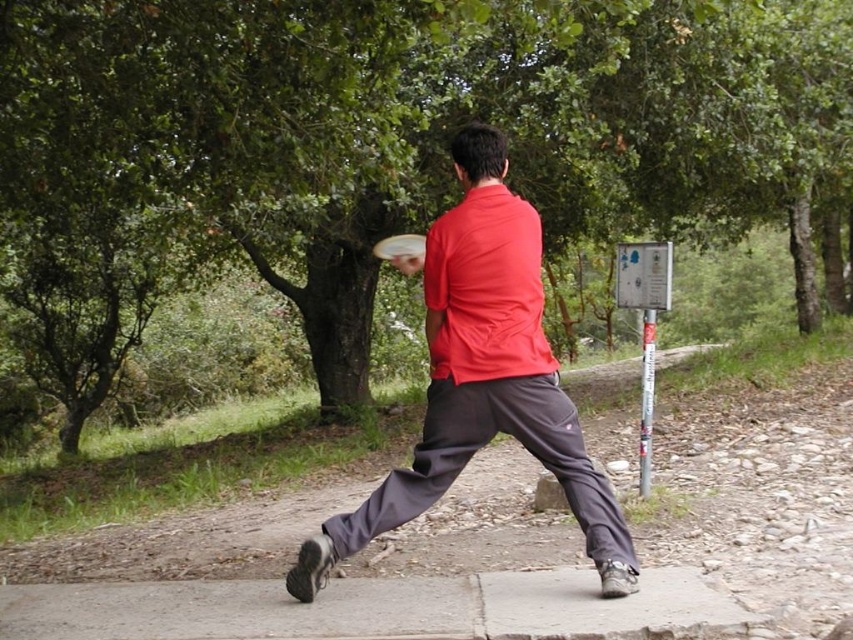
Can you confirm if green leafy tree at center is smaller than white plastic frisbee at center?

No.

The image size is (853, 640). I want to click on green leafy tree at center, so click(376, 145).

The width and height of the screenshot is (853, 640). I want to click on green leafy tree at center, so click(x=376, y=145).

Who is higher up, gray concrete pavement at lower center or white plastic frisbee at center?

white plastic frisbee at center is above.

Does point (717, 596) come farther from viewer compared to point (387, 257)?

That is False.

The height and width of the screenshot is (640, 853). Identify the location of gray concrete pavement at lower center. (379, 609).

Is green leafy tree at center thinner than matte red shirt at center?

A: In fact, green leafy tree at center might be wider than matte red shirt at center.

This screenshot has width=853, height=640. What do you see at coordinates (376, 145) in the screenshot? I see `green leafy tree at center` at bounding box center [376, 145].

Who is more forward, [677,180] or [519,208]?

Point [519,208]

Locate an element on the screen. The height and width of the screenshot is (640, 853). green leafy tree at center is located at coordinates (376, 145).